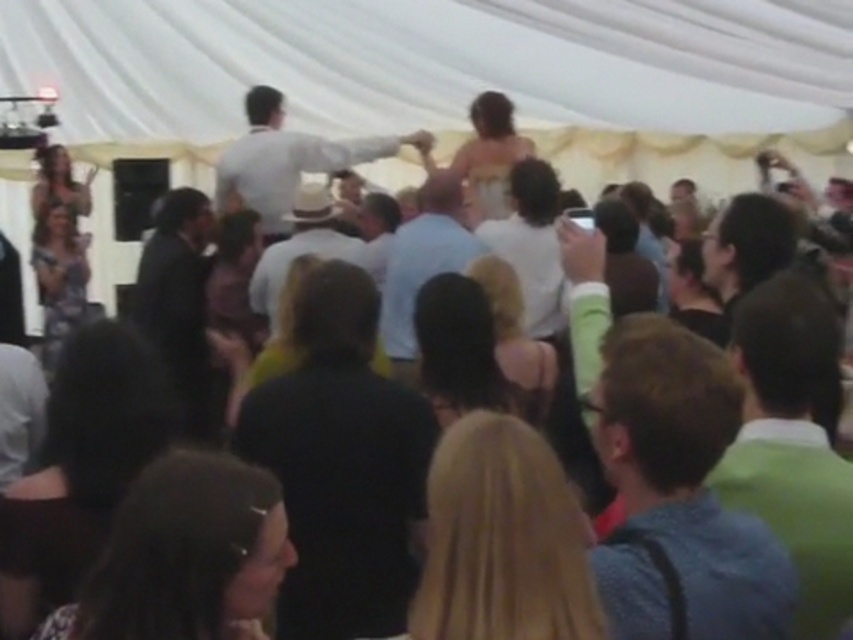
You are a photographer at the event and want to capture both the blue denim shirt at center and the green fabric shirt at right in a single shot. Since you can adjust the camera angle, which shirt should you focus on first to ensure both are in frame?

The blue denim shirt at center is shorter than the green fabric shirt at right. To include both in the frame, focus on the taller green fabric shirt at right first, then adjust the angle to include the shorter blue denim shirt at center.

Based on the photo, you are a photographer at the wedding reception and need to capture both the blue denim shirt at center and the green fabric shirt at right in a single frame. Given that your camera has a fixed focal length, which subject should you focus on to ensure both are in the frame without cropping?

You should focus on the blue denim shirt at center because its larger width compared to the green fabric shirt at right allows it to occupy more space in the frame, ensuring both subjects can be captured without cropping.

You are a photographer at the wedding reception and need to capture both the black matte shirt at center and the green fabric shirt at right in a single frame. Which shirt should you focus on to ensure both are fully visible without cropping?

To ensure both the black matte shirt at center and the green fabric shirt at right are fully visible without cropping, focus on the black matte shirt at center since it is wider than the green fabric shirt at right, allowing more space for composition.